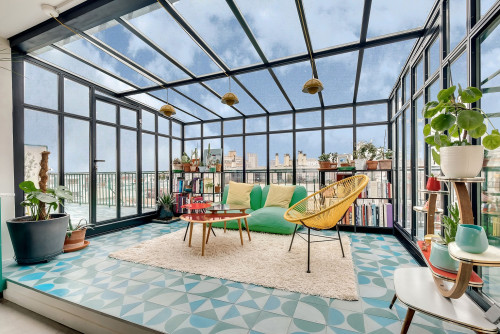
Find the location of a particular element. pillow is located at coordinates (242, 192), (279, 193).